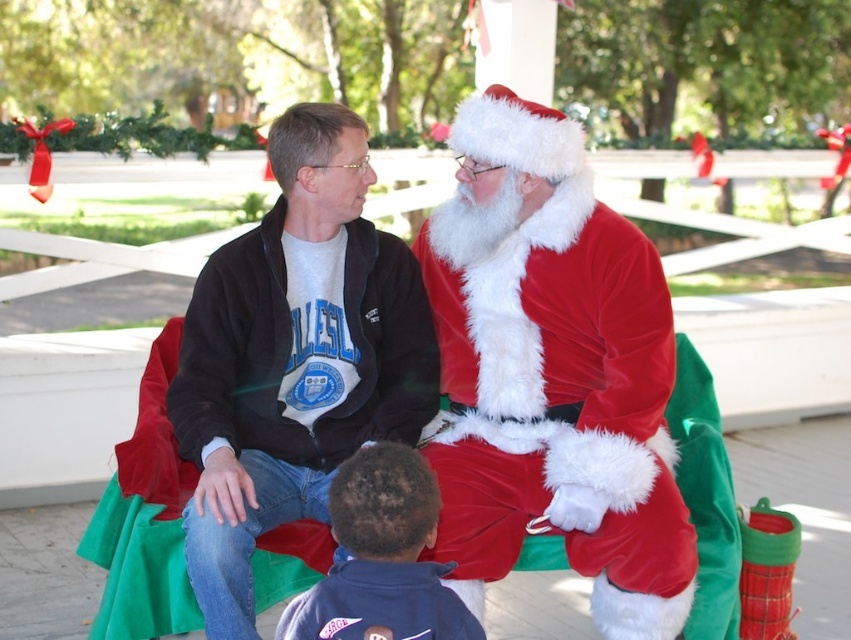
You are a photographer standing in front of the scene. You want to take a photo of the velvet santa claus at center and the dark blue fleece jacket at lower center. Which object should you focus on first if you want to capture both in the same frame without moving the camera?

You should focus on the dark blue fleece jacket at lower center first because the velvet santa claus at center is above it, so adjusting focus from the lower to the upper part will ensure both are in the frame.